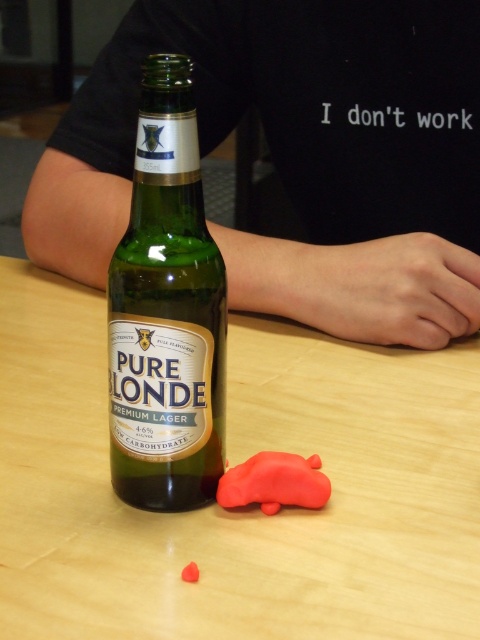
Question: Is black cotton shirt at upper center smaller than rubber car at lower center?

Choices:
 (A) no
 (B) yes

Answer: (A)

Question: Is wooden table at center further to the viewer compared to rubber car at lower center?

Choices:
 (A) no
 (B) yes

Answer: (A)

Question: Which object is closer to the camera taking this photo?

Choices:
 (A) green glass bottle at center
 (B) black cotton shirt at upper center
 (C) wooden table at center

Answer: (C)

Question: Which object appears farthest from the camera in this image?

Choices:
 (A) wooden table at center
 (B) rubber car at lower center
 (C) black cotton shirt at upper center

Answer: (C)

Question: Can you confirm if black cotton shirt at upper center is positioned below green glass bottle at center?

Choices:
 (A) no
 (B) yes

Answer: (A)

Question: Among these objects, which one is farthest from the camera?

Choices:
 (A) rubber car at lower center
 (B) black cotton shirt at upper center
 (C) green glass bottle at center

Answer: (B)